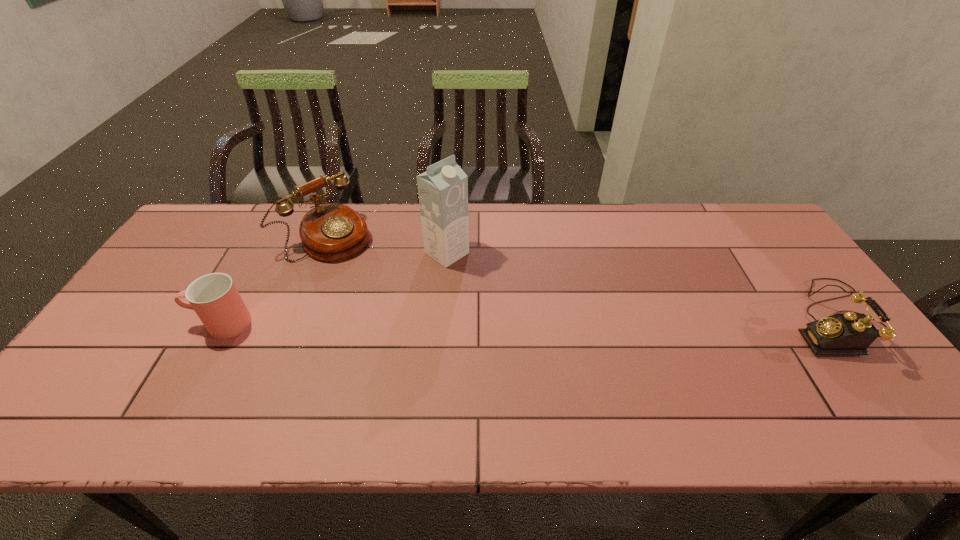
Find the location of a particular element. free space on the desktop that is between the cup and the rightmost object and is positioned on the dial of the taller telephone is located at coordinates (436, 322).

You are a GUI agent. You are given a task and a screenshot of the screen. Output one action in this format:
    pyautogui.click(x=<x>, y=<y>)
    Task: Click on the vacant spot on the desktop that is between the cup and the right telephone and is positioned on the front label of the carton
    
    Given the screenshot: What is the action you would take?
    pyautogui.click(x=544, y=321)